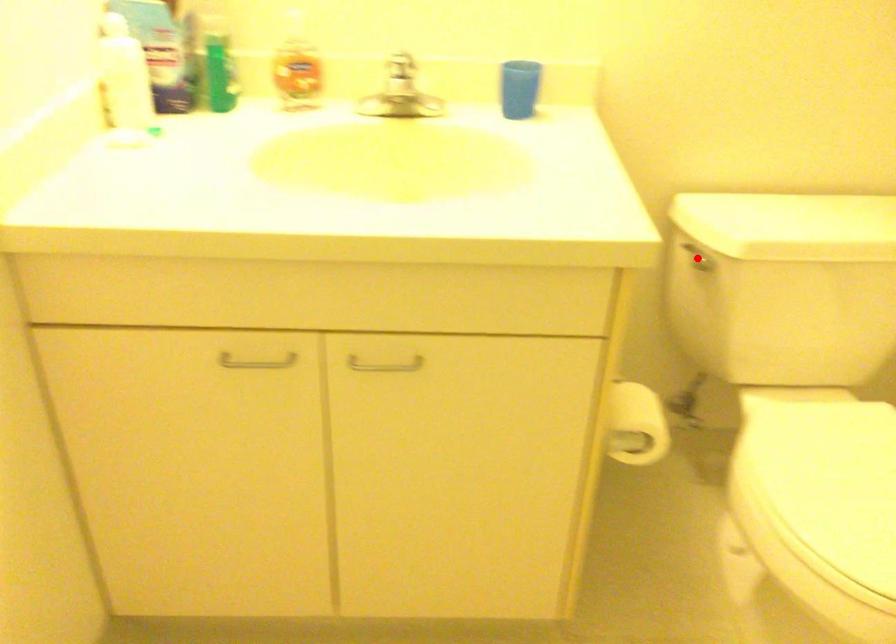
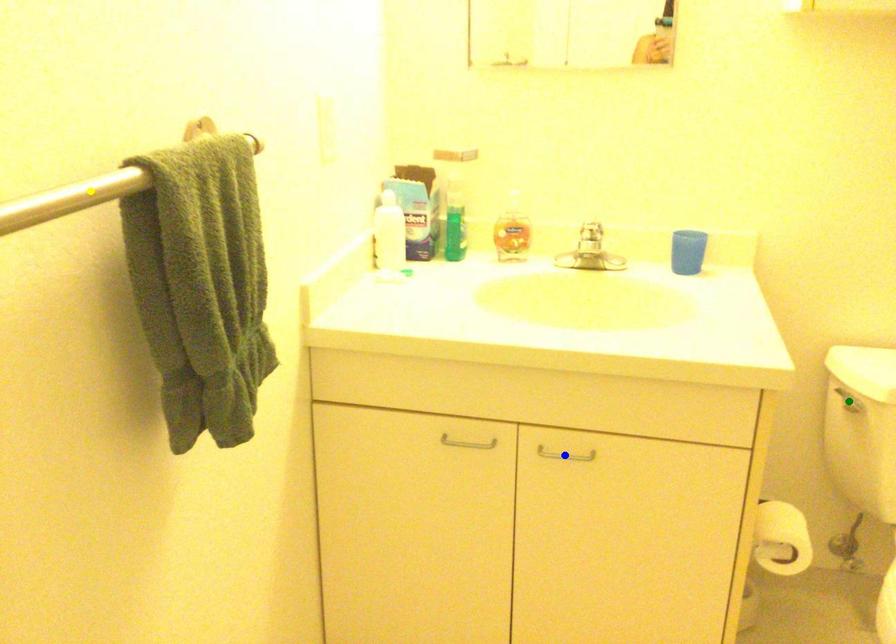
Question: I am providing you with two images of the same scene from different viewpoints. A red point is marked on the first image. You are given multiple points on the second image. Which point in image 2 is actually the same real-world point as the red point in image 1?

Choices:
 (A) green point
 (B) blue point
 (C) yellow point

Answer: (A)